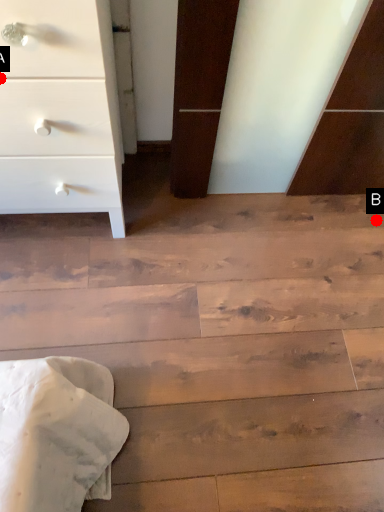
Question: Two points are circled on the image, labeled by A and B beside each circle. Among these points, which one is farthest from the camera?

Choices:
 (A) A is further
 (B) B is further

Answer: (B)